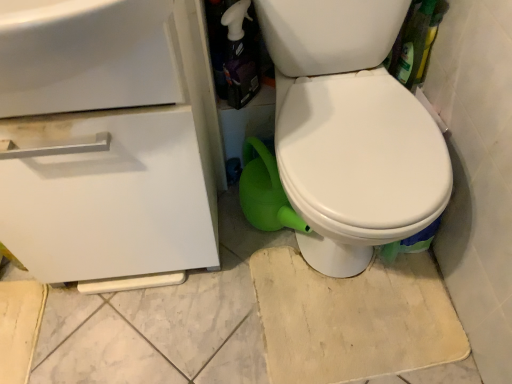
Question: From the image's perspective, is white glossy spray bottle at upper center beneath white matte drawer at left?

Choices:
 (A) no
 (B) yes

Answer: (A)

Question: Considering the relative sizes of white glossy spray bottle at upper center and white matte drawer at left in the image provided, is white glossy spray bottle at upper center shorter than white matte drawer at left?

Choices:
 (A) no
 (B) yes

Answer: (B)

Question: Does white glossy spray bottle at upper center have a larger size compared to white matte drawer at left?

Choices:
 (A) yes
 (B) no

Answer: (B)

Question: Is white glossy spray bottle at upper center behind white matte drawer at left?

Choices:
 (A) yes
 (B) no

Answer: (A)

Question: Is white glossy spray bottle at upper center to the right of white matte drawer at left from the viewer's perspective?

Choices:
 (A) no
 (B) yes

Answer: (B)

Question: Is white glossy spray bottle at upper center to the left of white matte drawer at left from the viewer's perspective?

Choices:
 (A) yes
 (B) no

Answer: (B)

Question: Considering the relative sizes of white matte drawer at left and white glossy sink at upper left in the image provided, is white matte drawer at left smaller than white glossy sink at upper left?

Choices:
 (A) yes
 (B) no

Answer: (B)

Question: Does white matte drawer at left contain white glossy sink at upper left?

Choices:
 (A) yes
 (B) no

Answer: (A)

Question: Is white matte drawer at left facing towards white glossy sink at upper left?

Choices:
 (A) yes
 (B) no

Answer: (B)

Question: From the image's perspective, is white matte drawer at left below white glossy sink at upper left?

Choices:
 (A) yes
 (B) no

Answer: (A)

Question: From the image's perspective, is white matte drawer at left located above white glossy sink at upper left?

Choices:
 (A) no
 (B) yes

Answer: (A)

Question: Considering the relative sizes of white matte drawer at left and white glossy sink at upper left in the image provided, is white matte drawer at left thinner than white glossy sink at upper left?

Choices:
 (A) yes
 (B) no

Answer: (A)

Question: Can you confirm if white matte drawer at left is shorter than white glossy spray bottle at upper center?

Choices:
 (A) no
 (B) yes

Answer: (A)